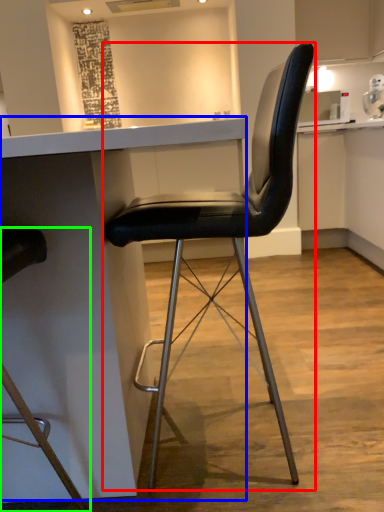
Question: Considering the real-world distances, which object is closest to chair (highlighted by a red box)? table (highlighted by a blue box) or chair (highlighted by a green box).

Choices:
 (A) table
 (B) chair

Answer: (A)